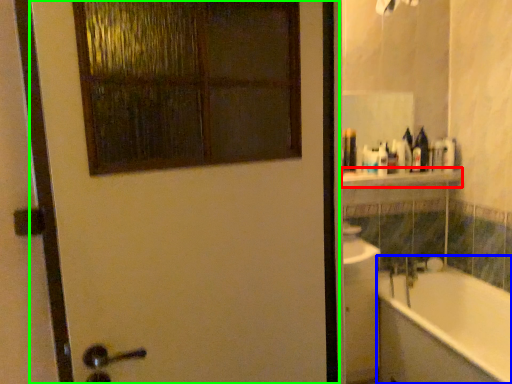
Question: Estimate the real-world distances between objects in this image. Which object is farther from balustrade (highlighted by a red box), bathtub (highlighted by a blue box) or door (highlighted by a green box)?

Choices:
 (A) bathtub
 (B) door

Answer: (B)